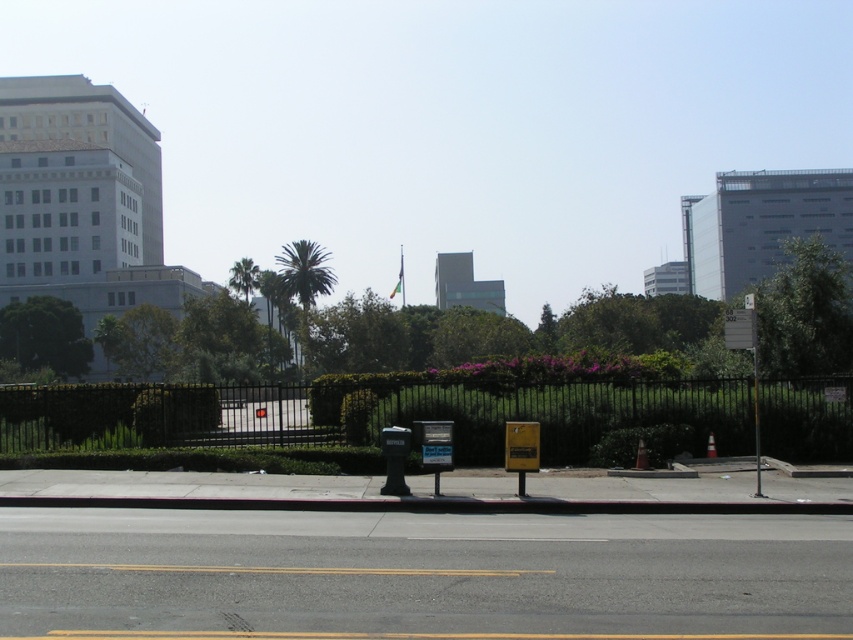
Question: Which point appears farthest from the camera in this image?

Choices:
 (A) (216, 400)
 (B) (277, 259)
 (C) (248, 300)

Answer: (B)

Question: Does green leafy hedge at left lie in front of green leafy tree at center?

Choices:
 (A) yes
 (B) no

Answer: (A)

Question: Is green leafy tree at upper right positioned behind black plastic parking meter at center?

Choices:
 (A) no
 (B) yes

Answer: (B)

Question: Which of the following is the farthest from the observer?

Choices:
 (A) green leafy palm tree at center
 (B) black plastic parking meter at center
 (C) green leafy tree at center
 (D) green leafy hedge at left

Answer: (C)

Question: Estimate the real-world distances between objects in this image. Which object is farther from the green leafy tree at center?

Choices:
 (A) green leafy palm tree at center
 (B) green leafy hedge at left
 (C) black plastic parking meter at center
 (D) green leafy tree at upper right

Answer: (C)

Question: Can you confirm if green leafy tree at upper right is positioned above green leafy palm tree at center?

Choices:
 (A) no
 (B) yes

Answer: (A)